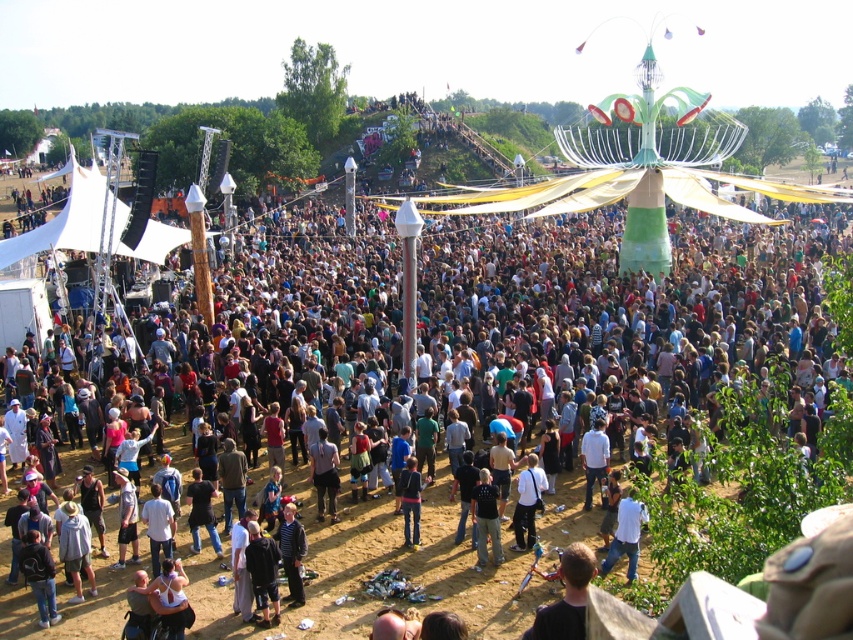
You are a photographer positioned at the center of the festival scene. You want to capture a photo of the dark gray fabric pants at lower center. Where should you aim your camera to include this subject in the frame?

You should aim your camera at point 0.742 on the horizontal axis and 0.381 on the vertical axis to capture the dark gray fabric pants at lower center in the frame.

You are a photographer at the festival and want to take a photo of both the black matte shirt at center and the white matte shirt at center. Which shirt should you focus on first to ensure both are in frame without moving the camera?

The black matte shirt at center is much taller than the white matte shirt at center, so you should focus on the black matte shirt at center first to ensure both are in frame without moving the camera.

You are a photographer at the festival and want to capture both the black matte shirt at center and the white matte shirt at center in a single frame. Which shirt should you position your camera to the right of to ensure both are visible?

You should position your camera to the right of the black matte shirt at center. Since the black matte shirt at center is to the left of the white matte shirt at center, placing the camera to the right of the black one will include both in the frame.